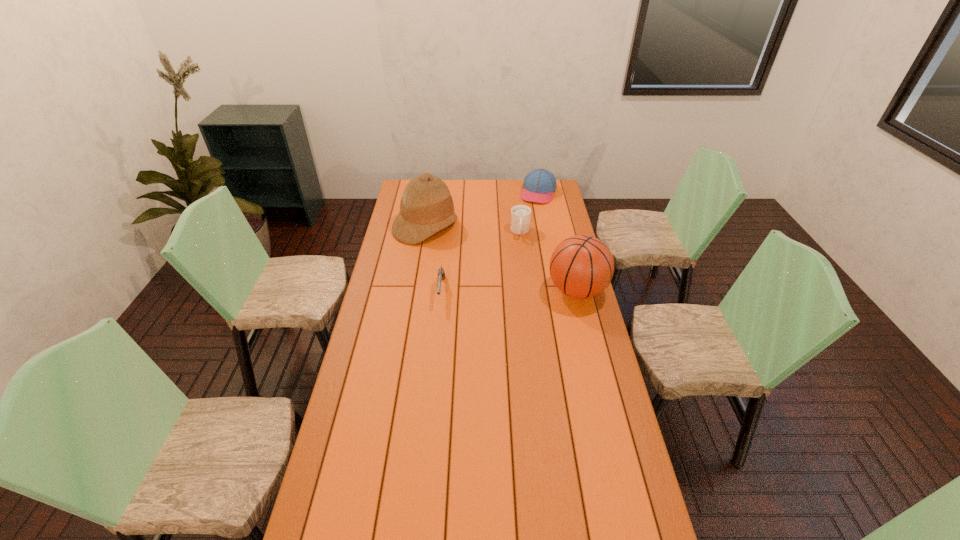
At what (x,y) coordinates should I click in order to perform the action: click on vacant point located 0.240m on the front-facing side of the hat. Please return your answer as a coordinate pair (x, y). Looking at the image, I should click on (481, 261).

Locate an element on the screen. The image size is (960, 540). vacant space situated on the front-facing side of the hat is located at coordinates (467, 252).

You are a GUI agent. You are given a task and a screenshot of the screen. Output one action in this format:
    pyautogui.click(x=<x>, y=<y>)
    Task: Click on the vacant space situated on the front-facing side of the hat
    The image size is (960, 540).
    Given the screenshot: What is the action you would take?
    pyautogui.click(x=462, y=249)

Identify the location of vacant region located on the front-facing side of the baseball cap. (519, 247).

This screenshot has width=960, height=540. Find the location of `vacant space located 0.130m on the front-facing side of the baseball cap`. vacant space located 0.130m on the front-facing side of the baseball cap is located at coordinates (531, 217).

Image resolution: width=960 pixels, height=540 pixels. I want to click on vacant space situated on the front-facing side of the baseball cap, so click(520, 245).

This screenshot has height=540, width=960. In order to click on object that is at the far edge in this screenshot , I will do `click(539, 185)`.

This screenshot has height=540, width=960. What are the coordinates of `object situated at the left edge` in the screenshot? It's located at click(426, 207).

Where is `basketball at the right edge`? This screenshot has width=960, height=540. basketball at the right edge is located at coordinates (582, 266).

The height and width of the screenshot is (540, 960). Find the location of `baseball cap that is at the right edge`. baseball cap that is at the right edge is located at coordinates click(x=539, y=185).